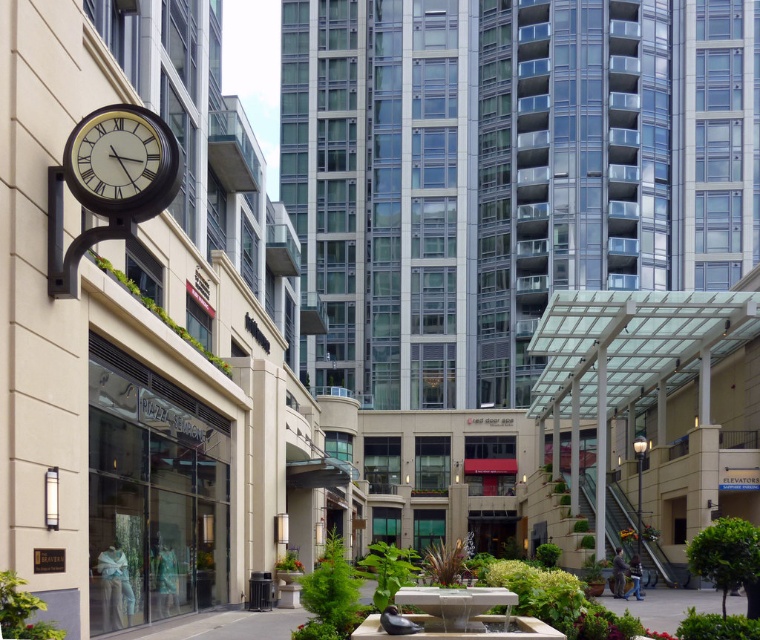
Question: Is matte white clock at upper left in front of white stone fountain at center?

Choices:
 (A) yes
 (B) no

Answer: (B)

Question: Which object is farther from the camera taking this photo?

Choices:
 (A) matte white clock at upper left
 (B) white stone fountain at center

Answer: (A)

Question: Does matte white clock at upper left have a larger size compared to white stone fountain at center?

Choices:
 (A) no
 (B) yes

Answer: (A)

Question: Is matte white clock at upper left to the right of white stone fountain at center from the viewer's perspective?

Choices:
 (A) yes
 (B) no

Answer: (B)

Question: Which point is farther from the camera taking this photo?

Choices:
 (A) (464, 595)
 (B) (157, 125)

Answer: (A)